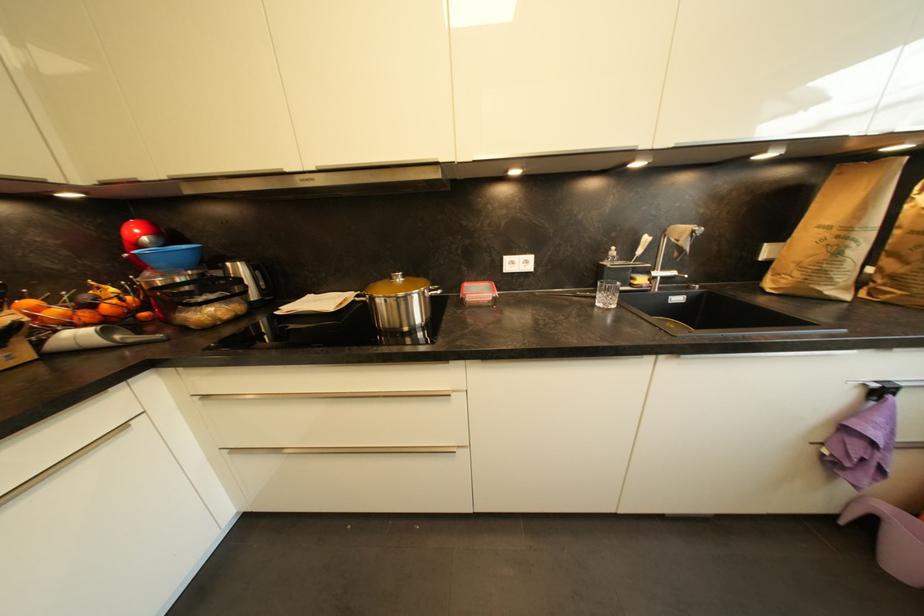
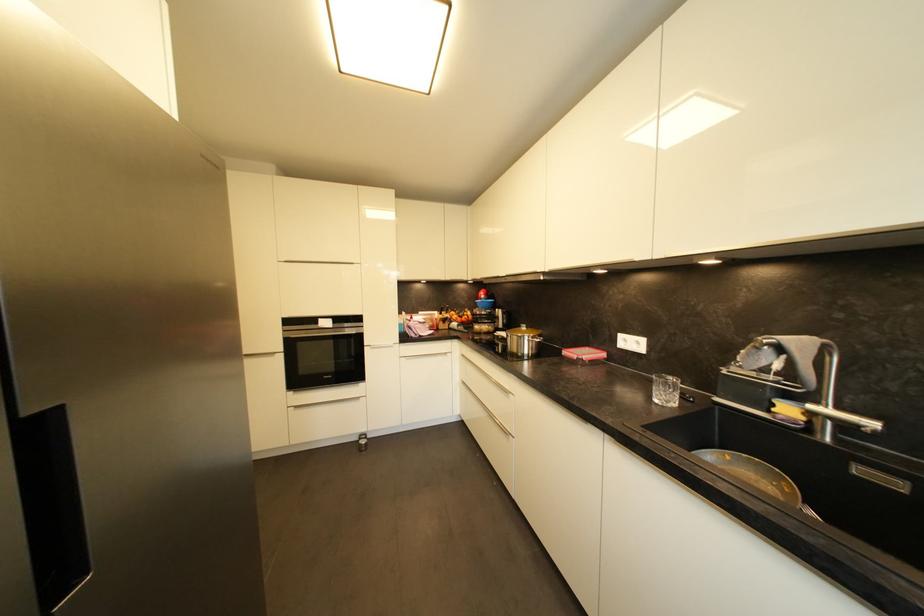
Locate, in the second image, the point that corresponds to point 531,264 in the first image.

(642, 345)